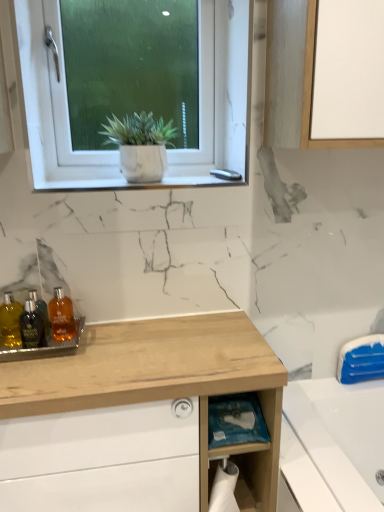
I want to click on empty space that is to the right of translucent amber bottle at lower left, so click(x=100, y=349).